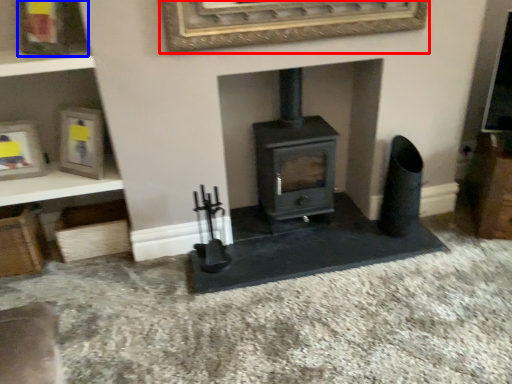
Question: Among these objects, which one is farthest to the camera, picture frame (highlighted by a red box) or picture frame (highlighted by a blue box)?

Choices:
 (A) picture frame
 (B) picture frame

Answer: (B)